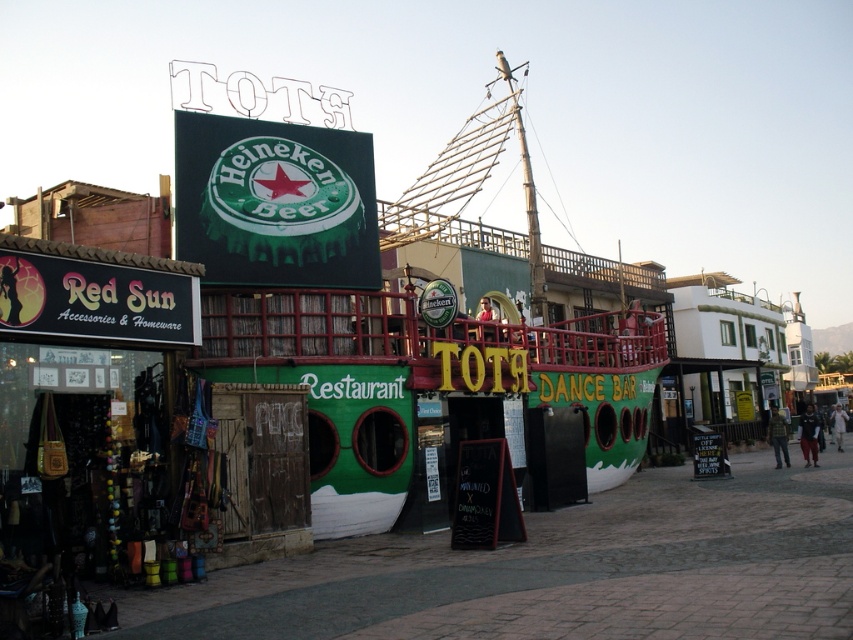
Does point (428, 205) come farther from viewer compared to point (80, 330)?

That is True.

In the scene shown: Is green matte boat at center shorter than yellow text on black signboard at lower left?

Incorrect, green matte boat at center's height does not fall short of yellow text on black signboard at lower left's.

Where is `green matte boat at center`? This screenshot has width=853, height=640. green matte boat at center is located at coordinates (469, 180).

Can you confirm if green matte heineken sign at upper center is wider than yellow text on black signboard at lower left?

Correct, the width of green matte heineken sign at upper center exceeds that of yellow text on black signboard at lower left.

Can you confirm if green matte heineken sign at upper center is bigger than yellow text on black signboard at lower left?

Indeed, green matte heineken sign at upper center has a larger size compared to yellow text on black signboard at lower left.

Where is `green matte heineken sign at upper center`? This screenshot has width=853, height=640. green matte heineken sign at upper center is located at coordinates (276, 202).

Is green matte heineken sign at upper center positioned before green matte boat at center?

Yes, it is in front of green matte boat at center.

Is green matte heineken sign at upper center positioned at the back of green matte boat at center?

That is False.

Locate an element on the screen. green matte heineken sign at upper center is located at coordinates pos(276,202).